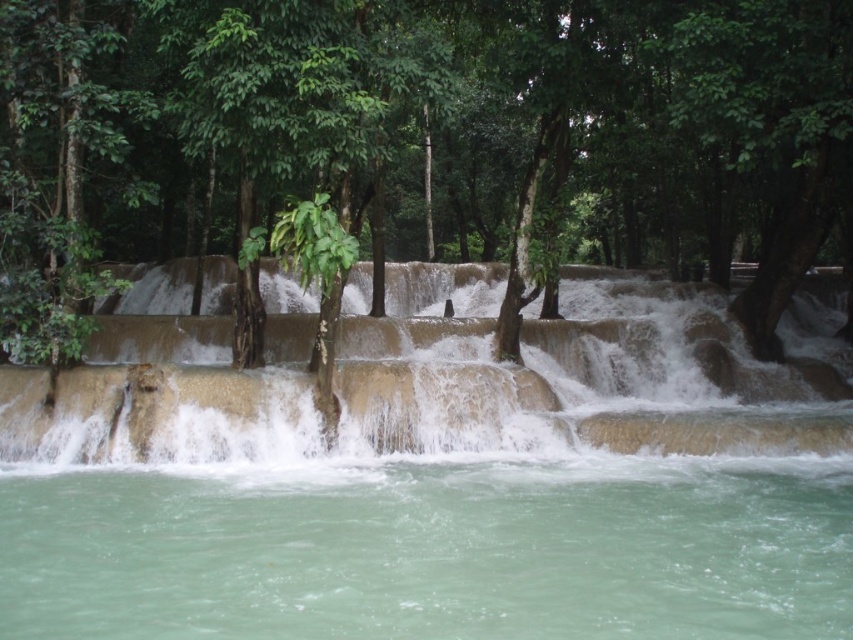
You are standing at the edge of the water and want to reach the green leafy tree at center. Which direction should you move relative to the clear water at lower center?

The green leafy tree at center is to the right of clear water at lower center, so you should move to the right of the clear water at lower center to reach it.

You are standing at the edge of the water and see the green leafy tree at center and the clear water at lower center. Which object is closer to you?

The green leafy tree at center is closer to you because the clear water at lower center is behind it.